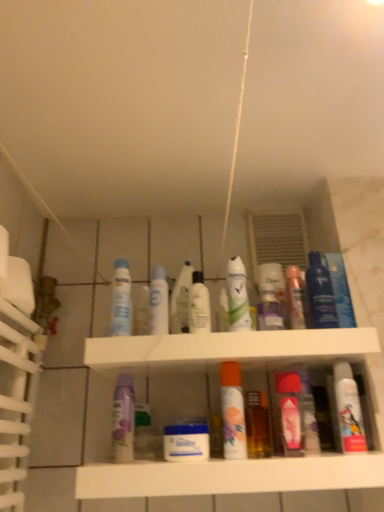
What do you see at coordinates (320, 294) in the screenshot? Image resolution: width=384 pixels, height=512 pixels. I see `blue glossy mouthwash at upper right, the 2th mouthwash positioned from the right` at bounding box center [320, 294].

What do you see at coordinates (199, 305) in the screenshot? This screenshot has width=384, height=512. I see `clear plastic bottle at center, the 6th mouthwash viewed from the right` at bounding box center [199, 305].

What do you see at coordinates (308, 416) in the screenshot? The height and width of the screenshot is (512, 384). I see `pink glossy mouthwash at center, placed as the third mouthwash when sorted from right to left` at bounding box center [308, 416].

Measure the distance between point (112, 440) and camera.

The distance of point (112, 440) from camera is 1.00 meters.

Where is `white glossy mouthwash at center, which is counted as the third mouthwash, starting from the left`? The width and height of the screenshot is (384, 512). white glossy mouthwash at center, which is counted as the third mouthwash, starting from the left is located at coordinates (181, 300).

Find the location of a particular element. translucent plastic spray can at center, the first toiletry in the right-to-left sequence is located at coordinates (296, 298).

Are white glossy mouthwash at center, arranged as the 9th mouthwash when viewed from the right, and white glossy mouthwash at right, which ranks as the 10th mouthwash in left-to-right order, located far from each other?

white glossy mouthwash at center, arranged as the 9th mouthwash when viewed from the right, is near white glossy mouthwash at right, which ranks as the 10th mouthwash in left-to-right order, not far away.

Between white glossy mouthwash at center, which is the second mouthwash in left-to-right order, and white glossy mouthwash at right, positioned as the first mouthwash in right-to-left order, which one appears on the left side from the viewer's perspective?

From the viewer's perspective, white glossy mouthwash at center, which is the second mouthwash in left-to-right order, appears more on the left side.

How different are the orientations of white glossy mouthwash at center, which is the second mouthwash in left-to-right order, and white glossy mouthwash at right, positioned as the first mouthwash in right-to-left order, in degrees?

white glossy mouthwash at center, which is the second mouthwash in left-to-right order, and white glossy mouthwash at right, positioned as the first mouthwash in right-to-left order, are facing 0.00158 degrees away from each other.

Which of these two, white glossy mouthwash at center, arranged as the 9th mouthwash when viewed from the right, or white glossy mouthwash at right, which ranks as the 10th mouthwash in left-to-right order, is smaller?

Smaller between the two is white glossy mouthwash at right, which ranks as the 10th mouthwash in left-to-right order.

Considering the relative sizes of matte pink spray can at center, arranged as the 1th cleaning product when ordered from the bottom, and white plastic shelf at center in the image provided, is matte pink spray can at center, arranged as the 1th cleaning product when ordered from the bottom, smaller than white plastic shelf at center?

Correct, matte pink spray can at center, arranged as the 1th cleaning product when ordered from the bottom, occupies less space than white plastic shelf at center.

This screenshot has width=384, height=512. Find the location of `shelf below the matte pink spray can at center, which ranks as the 1th cleaning product in right-to-left order (from the image's perspective)`. shelf below the matte pink spray can at center, which ranks as the 1th cleaning product in right-to-left order (from the image's perspective) is located at coordinates [244, 370].

Which is in front, point (290, 404) or point (327, 336)?

The point (290, 404) is closer.

Is matte pink spray can at center, the second cleaning product in the top-to-bottom sequence, inside or outside of white plastic shelf at center?

matte pink spray can at center, the second cleaning product in the top-to-bottom sequence, fits inside white plastic shelf at center.

From a real-world perspective, who is located lower, white glossy mouthwash at center, the 8th mouthwash positioned from the right, or blue plastic container at center, the seventh mouthwash when ordered from right to left?

blue plastic container at center, the seventh mouthwash when ordered from right to left, from a real-world perspective.

Considering the sizes of white glossy mouthwash at center, which is counted as the third mouthwash, starting from the left, and blue plastic container at center, which appears as the fourth mouthwash when viewed from the left, in the image, is white glossy mouthwash at center, which is counted as the third mouthwash, starting from the left, taller or shorter than blue plastic container at center, which appears as the fourth mouthwash when viewed from the left,?

white glossy mouthwash at center, which is counted as the third mouthwash, starting from the left, is taller than blue plastic container at center, which appears as the fourth mouthwash when viewed from the left.

Which is farther from the camera, (175,317) or (208,448)?

The point (175,317) is behind.

Between white glossy mouthwash at center, the fourth mouthwash viewed from the right, and white glossy mouthwash at center, arranged as the 9th mouthwash when viewed from the right, which one has more height?

white glossy mouthwash at center, arranged as the 9th mouthwash when viewed from the right.

Is there a large distance between white glossy mouthwash at center, arranged as the 7th mouthwash when viewed from the left, and white glossy mouthwash at center, which is the second mouthwash in left-to-right order?

No, white glossy mouthwash at center, arranged as the 7th mouthwash when viewed from the left, is not far away from white glossy mouthwash at center, which is the second mouthwash in left-to-right order.

Could you tell me if white glossy mouthwash at center, the fourth mouthwash viewed from the right, is facing white glossy mouthwash at center, which is the second mouthwash in left-to-right order?

No, white glossy mouthwash at center, the fourth mouthwash viewed from the right, is not oriented towards white glossy mouthwash at center, which is the second mouthwash in left-to-right order.

From the image's perspective, is white glossy mouthwash at center, the fourth mouthwash viewed from the right, below white glossy mouthwash at center, arranged as the 9th mouthwash when viewed from the right?

No.

Is point (190, 294) positioned behind point (228, 260)?

That is False.

How different are the orientations of clear plastic bottle at center, which appears as the 5th mouthwash when viewed from the left, and white glossy mouthwash at center, the fourth mouthwash viewed from the right, in degrees?

There is a 0.00256-degree angle between the facing directions of clear plastic bottle at center, which appears as the 5th mouthwash when viewed from the left, and white glossy mouthwash at center, the fourth mouthwash viewed from the right.

Is clear plastic bottle at center, which appears as the 5th mouthwash when viewed from the left, directly adjacent to white glossy mouthwash at center, arranged as the 7th mouthwash when viewed from the left?

Yes.

Considering the sizes of objects clear plastic bottle at center, which appears as the 5th mouthwash when viewed from the left, and white glossy mouthwash at center, the fourth mouthwash viewed from the right, in the image provided, who is wider, clear plastic bottle at center, which appears as the 5th mouthwash when viewed from the left, or white glossy mouthwash at center, the fourth mouthwash viewed from the right,?

Wider between the two is white glossy mouthwash at center, the fourth mouthwash viewed from the right.

Based on their sizes in the image, would you say white glossy mouthwash at center, which is counted as the third mouthwash, starting from the left, is bigger or smaller than matte pink spray can at center, which ranks as the 1th cleaning product in right-to-left order?

Considering their sizes, white glossy mouthwash at center, which is counted as the third mouthwash, starting from the left, takes up more space than matte pink spray can at center, which ranks as the 1th cleaning product in right-to-left order.

Considering the relative sizes of white glossy mouthwash at center, which is counted as the third mouthwash, starting from the left, and matte pink spray can at center, arranged as the 1th cleaning product when ordered from the bottom, in the image provided, is white glossy mouthwash at center, which is counted as the third mouthwash, starting from the left, taller than matte pink spray can at center, arranged as the 1th cleaning product when ordered from the bottom,?

Correct, white glossy mouthwash at center, which is counted as the third mouthwash, starting from the left, is much taller as matte pink spray can at center, arranged as the 1th cleaning product when ordered from the bottom.

Can you tell me how much white glossy mouthwash at center, which is counted as the third mouthwash, starting from the left, and matte pink spray can at center, which ranks as the 1th cleaning product in right-to-left order, differ in facing direction?

0.000562 degrees separate the facing orientations of white glossy mouthwash at center, which is counted as the third mouthwash, starting from the left, and matte pink spray can at center, which ranks as the 1th cleaning product in right-to-left order.

Is the position of white glossy mouthwash at center, the 8th mouthwash positioned from the right, more distant than that of matte pink spray can at center, positioned as the second cleaning product in left-to-right order?

Yes.

Which mouthwash is the 6th one when counting from the back of the white glossy mouthwash at right, positioned as the first mouthwash in right-to-left order? Please provide its 2D coordinates.

[(199, 305)]

Is white glossy mouthwash at right, positioned as the first mouthwash in right-to-left order, taller than clear plastic bottle at center, the 6th mouthwash viewed from the right?

Yes.

In the scene shown: Is white glossy mouthwash at right, positioned as the first mouthwash in right-to-left order, to the right of clear plastic bottle at center, which appears as the 5th mouthwash when viewed from the left, from the viewer's perspective?

Correct, you'll find white glossy mouthwash at right, positioned as the first mouthwash in right-to-left order, to the right of clear plastic bottle at center, which appears as the 5th mouthwash when viewed from the left.

From a real-world perspective, count 6th mouthwashs downward from the white glossy mouthwash at center, which is the second mouthwash in left-to-right order, and point to it. Please provide its 2D coordinates.

[(348, 409)]

In order to click on cleaning product that is the 1st one when counting upward from the white plastic shelf at center (from the image's perspective) in this screenshot , I will do `click(290, 412)`.

From the image, which object appears to be nearer to matte purple lotion at center, the 1th toiletry positioned from the left, white plastic shelf at center or blue glossy mouthwash at upper right, which ranks as the 9th mouthwash in left-to-right order?

Among the two, blue glossy mouthwash at upper right, which ranks as the 9th mouthwash in left-to-right order, is located nearer to matte purple lotion at center, the 1th toiletry positioned from the left.

When comparing their distances from blue glossy mouthwash at upper right, the 2th mouthwash positioned from the right, does white glossy mouthwash at center, which is counted as the third mouthwash, starting from the left, or pink glossy mouthwash at center, acting as the eighth mouthwash starting from the left, seem further?

white glossy mouthwash at center, which is counted as the third mouthwash, starting from the left.

Looking at the image, which one is located further to matte white spray can at center, acting as the second cleaning product starting from the bottom, clear plastic bottle at center, which appears as the 5th mouthwash when viewed from the left, or white glossy mouthwash at center, the fourth mouthwash viewed from the right?

white glossy mouthwash at center, the fourth mouthwash viewed from the right, is further to matte white spray can at center, acting as the second cleaning product starting from the bottom.

From the image, which object appears to be nearer to blue glossy mouthwash at upper right, the 2th mouthwash positioned from the right, white glossy mouthwash at center, arranged as the 7th mouthwash when viewed from the left, or white glossy mouthwash at center, which is counted as the third mouthwash, starting from the left?

white glossy mouthwash at center, arranged as the 7th mouthwash when viewed from the left, is positioned closer to the anchor blue glossy mouthwash at upper right, the 2th mouthwash positioned from the right.

From the image, which object appears to be nearer to matte white spray can at center, placed as the 2th cleaning product when sorted from right to left, white glossy mouthwash at center, which is the second mouthwash in left-to-right order, or matte purple lotion at center, which is the 2th toiletry from right to left?

white glossy mouthwash at center, which is the second mouthwash in left-to-right order, is closer to matte white spray can at center, placed as the 2th cleaning product when sorted from right to left.

Based on their spatial positions, is matte pink spray can at center, which ranks as the 1th cleaning product in right-to-left order, or white glossy mouthwash at center, the 8th mouthwash positioned from the right, closer to blue plastic container at center, the seventh mouthwash when ordered from right to left?

Based on the image, matte pink spray can at center, which ranks as the 1th cleaning product in right-to-left order, appears to be nearer to blue plastic container at center, the seventh mouthwash when ordered from right to left.

When comparing their distances from matte pink spray can at center, arranged as the 1th cleaning product when ordered from the bottom, does pink glossy mouthwash at center, acting as the eighth mouthwash starting from the left, or matte white spray can at center, acting as the second cleaning product starting from the bottom, seem closer?

Among the two, pink glossy mouthwash at center, acting as the eighth mouthwash starting from the left, is located nearer to matte pink spray can at center, arranged as the 1th cleaning product when ordered from the bottom.

Estimate the real-world distances between objects in this image. Which object is closer to translucent plastic spray can at center, the first toiletry in the right-to-left sequence, white glossy mouthwash at center, the fourth mouthwash viewed from the right, or purple matte mouthwash at center, the tenth mouthwash from the right?

white glossy mouthwash at center, the fourth mouthwash viewed from the right, is positioned closer to the anchor translucent plastic spray can at center, the first toiletry in the right-to-left sequence.

I want to click on shelf between purple matte mouthwash at center, the first mouthwash when ordered from left to right, and matte purple lotion at center, which is the 2th toiletry from right to left, so click(244, 370).

At what (x,y) coordinates should I click in order to perform the action: click on shelf that lies between white glossy mouthwash at center, arranged as the 9th mouthwash when viewed from the right, and blue plastic container at center, the seventh mouthwash when ordered from right to left, from top to bottom. Please return your answer as a coordinate pair (x, y). Looking at the image, I should click on (244, 370).

Locate an element on the screen. This screenshot has width=384, height=512. toiletry between translucent plastic spray can at center, the first toiletry in the right-to-left sequence, and blue plastic container at center, the seventh mouthwash when ordered from right to left, from top to bottom is located at coordinates (272, 294).

Where is `shelf that lies between blue glossy mouthwash at upper right, the 2th mouthwash positioned from the right, and blue plastic container at center, which appears as the fourth mouthwash when viewed from the left, from top to bottom`? Image resolution: width=384 pixels, height=512 pixels. shelf that lies between blue glossy mouthwash at upper right, the 2th mouthwash positioned from the right, and blue plastic container at center, which appears as the fourth mouthwash when viewed from the left, from top to bottom is located at coordinates (244, 370).